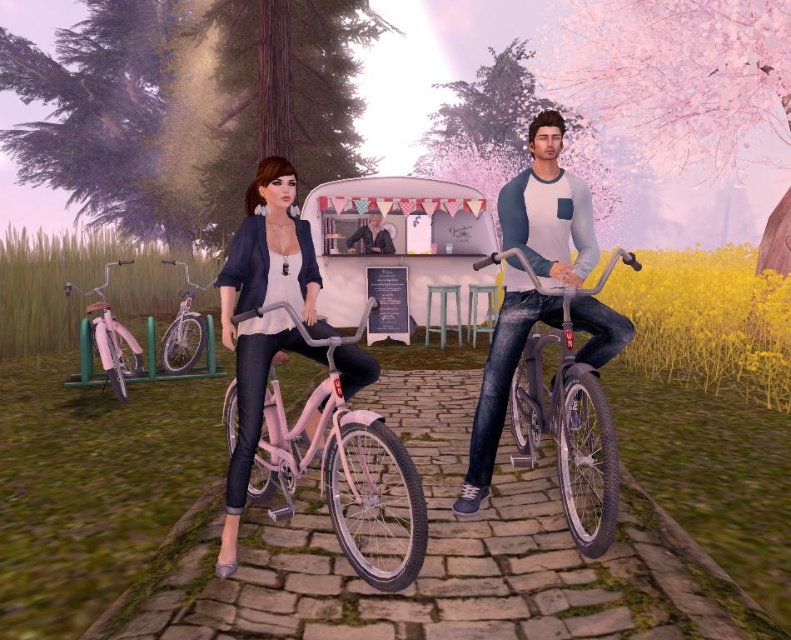
You are a delivery person who needs to place a package between the pink matte bicycle at left and the smooth black jacket at center. The package requires a space of 5 meters to be placed safely. Can you fit the package between them?

The pink matte bicycle at left and the smooth black jacket at center are 4.81 meters apart, so the package requiring 5 meters cannot be placed safely between them as the distance is insufficient.

You are planning to ride a bicycle that is exactly the same size as the smooth black jacket at center. Looking at the scene, can you determine if the pink matte bicycle at left is suitable for your ride?

The pink matte bicycle at left has a smaller size compared to the smooth black jacket at center. Since your bicycle is the same size as the smooth black jacket at center, the pink matte bicycle at left would be too small for your ride.

You are planning to ride a narrow path that can only accommodate bicycles with a width of 20 cm. You have the metallic pink bicycle at center and the shiny silver bicycle at left. Which bicycle should you choose to ride through the path?

The metallic pink bicycle at center is thinner than the shiny silver bicycle at left, so you should choose the metallic pink bicycle at center to ride through the narrow path since it is narrower and can fit within the 20 cm width requirement.